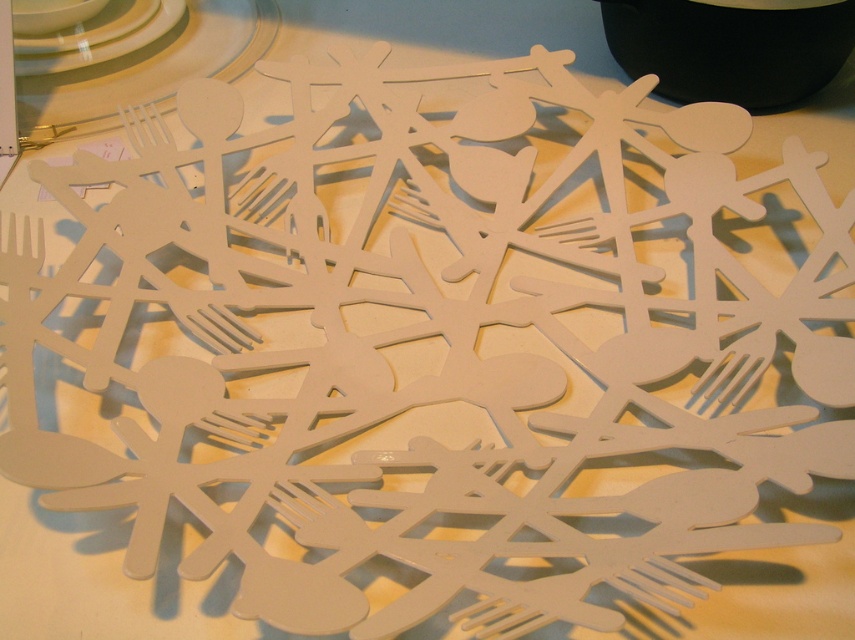
Can you confirm if black matte bottle at upper right is thinner than white glossy plate at upper left?

In fact, black matte bottle at upper right might be wider than white glossy plate at upper left.

Who is lower down, black matte bottle at upper right or white glossy plate at upper left?

black matte bottle at upper right

Between point (846, 10) and point (143, 4), which one is positioned in front?

Point (846, 10)

At what (x,y) coordinates should I click in order to perform the action: click on black matte bottle at upper right. Please return your answer as a coordinate pair (x, y). The image size is (855, 640). Looking at the image, I should click on (730, 45).

Does point (264, 29) lie in front of point (174, 17)?

No.

Which is behind, point (245, 10) or point (84, 58)?

Positioned behind is point (245, 10).

Who is more distant from viewer, (x=133, y=104) or (x=171, y=4)?

Point (x=171, y=4)

Locate an element on the screen. Image resolution: width=855 pixels, height=640 pixels. matte white plastic fork at upper left is located at coordinates (146, 68).

Who is more forward, (x=690, y=42) or (x=109, y=115)?

Point (x=690, y=42) is in front.

Is point (818, 1) farther from camera compared to point (258, 6)?

No, it is not.

Locate an element on the screen. black matte bottle at upper right is located at coordinates (730, 45).

Find the location of a particular element. black matte bottle at upper right is located at coordinates (730, 45).